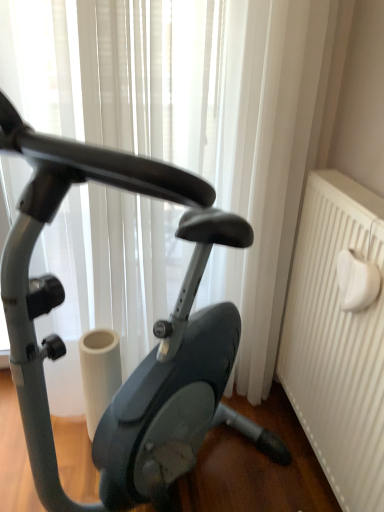
The image size is (384, 512). What do you see at coordinates (153, 331) in the screenshot?
I see `matte black stationary bicycle at center` at bounding box center [153, 331].

Locate an element on the screen. The width and height of the screenshot is (384, 512). matte black stationary bicycle at center is located at coordinates tap(153, 331).

I want to click on white textured radiator at right, so click(337, 340).

What do you see at coordinates (337, 340) in the screenshot? I see `white textured radiator at right` at bounding box center [337, 340].

Where is `matte black stationary bicycle at center`? The image size is (384, 512). matte black stationary bicycle at center is located at coordinates (153, 331).

Which object is positioned more to the right, white textured radiator at right or matte black stationary bicycle at center?

white textured radiator at right.

Which object is further away from the camera, white textured radiator at right or matte black stationary bicycle at center?

Positioned behind is white textured radiator at right.

Considering the positions of points (314, 409) and (90, 147), is point (314, 409) closer to camera compared to point (90, 147)?

No, (314, 409) is behind (90, 147).

From the image's perspective, which is above, white textured radiator at right or matte black stationary bicycle at center?

matte black stationary bicycle at center appears higher in the image.

From a real-world perspective, between white textured radiator at right and matte black stationary bicycle at center, who is vertically lower?

In real-world perspective, white textured radiator at right is lower.

Looking at their sizes, would you say white textured radiator at right is wider or thinner than matte black stationary bicycle at center?

white textured radiator at right is thinner than matte black stationary bicycle at center.

Based on the photo, from their relative heights in the image, would you say white textured radiator at right is taller or shorter than matte black stationary bicycle at center?

white textured radiator at right is shorter than matte black stationary bicycle at center.

In terms of size, does white textured radiator at right appear bigger or smaller than matte black stationary bicycle at center?

Considering their sizes, white textured radiator at right takes up less space than matte black stationary bicycle at center.

Is white textured radiator at right located outside matte black stationary bicycle at center?

Yes, white textured radiator at right is outside of matte black stationary bicycle at center.

Are white textured radiator at right and matte black stationary bicycle at center making contact?

No, white textured radiator at right is not in contact with matte black stationary bicycle at center.

Is white textured radiator at right turned away from matte black stationary bicycle at center?

Absolutely, white textured radiator at right is directed away from matte black stationary bicycle at center.

Where is `radiator behind the matte black stationary bicycle at center`? Image resolution: width=384 pixels, height=512 pixels. radiator behind the matte black stationary bicycle at center is located at coordinates (x=337, y=340).

Is matte black stationary bicycle at center at the left side of white textured radiator at right?

Yes.

Considering the positions of objects matte black stationary bicycle at center and white textured radiator at right in the image provided, who is in front, matte black stationary bicycle at center or white textured radiator at right?

matte black stationary bicycle at center is closer to the camera.

Between point (42, 139) and point (310, 280), which one is positioned behind?

The point (310, 280) is behind.

From the image's perspective, which one is positioned higher, matte black stationary bicycle at center or white textured radiator at right?

matte black stationary bicycle at center is shown above in the image.

From a real-world perspective, relative to white textured radiator at right, is matte black stationary bicycle at center vertically above or below?

From a real-world perspective, matte black stationary bicycle at center is physically above white textured radiator at right.

Considering the relative sizes of matte black stationary bicycle at center and white textured radiator at right in the image provided, is matte black stationary bicycle at center thinner than white textured radiator at right?

No, matte black stationary bicycle at center is not thinner than white textured radiator at right.

Is matte black stationary bicycle at center taller or shorter than white textured radiator at right?

Considering their sizes, matte black stationary bicycle at center has more height than white textured radiator at right.

Between matte black stationary bicycle at center and white textured radiator at right, which one has smaller size?

Smaller between the two is white textured radiator at right.

Is matte black stationary bicycle at center inside the boundaries of white textured radiator at right, or outside?

matte black stationary bicycle at center lies outside white textured radiator at right.

Can you see matte black stationary bicycle at center touching white textured radiator at right?

There is a gap between matte black stationary bicycle at center and white textured radiator at right.

Is matte black stationary bicycle at center positioned with its back to white textured radiator at right?

No, matte black stationary bicycle at center is not facing away from white textured radiator at right.

How many degrees apart are the facing directions of matte black stationary bicycle at center and white textured radiator at right?

The angle between the facing direction of matte black stationary bicycle at center and the facing direction of white textured radiator at right is 40.4 degrees.

The image size is (384, 512). Find the location of `radiator located on the right of matte black stationary bicycle at center`. radiator located on the right of matte black stationary bicycle at center is located at coordinates (337, 340).

At what (x,y) coordinates should I click in order to perform the action: click on stationary bicycle that is above the white textured radiator at right (from a real-world perspective). Please return your answer as a coordinate pair (x, y). The width and height of the screenshot is (384, 512). Looking at the image, I should click on (153, 331).

At what (x,y) coordinates should I click in order to perform the action: click on stationary bicycle lying above the white textured radiator at right (from the image's perspective). Please return your answer as a coordinate pair (x, y). The height and width of the screenshot is (512, 384). Looking at the image, I should click on (153, 331).